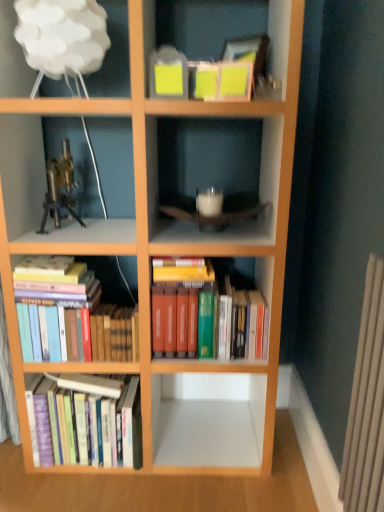
Question: Is hardcover books at lower left, which is counted as the second book, starting from the right, taller or shorter than gold metallic microscope at upper left?

Choices:
 (A) short
 (B) tall

Answer: (B)

Question: From a real-world perspective, is hardcover books at lower left, which is counted as the second book, starting from the right, above or below gold metallic microscope at upper left?

Choices:
 (A) above
 (B) below

Answer: (B)

Question: Which object is the closest to the hardcover books at center, placed as the first book when sorted from right to left?

Choices:
 (A) hardcover books at lower left, positioned as the 2th book in left-to-right order
 (B) hardcover books at lower left, which is the 3th book in right-to-left order
 (C) white cloud lampshade at upper left
 (D) gold metallic microscope at upper left

Answer: (A)

Question: Estimate the real-world distances between objects in this image. Which object is farther from the gold metallic microscope at upper left?

Choices:
 (A) hardcover books at center, marked as the 3th book in a left-to-right arrangement
 (B) white cloud lampshade at upper left
 (C) hardcover books at lower left, positioned as the 2th book in left-to-right order
 (D) hardcover books at lower left, which is the 1th book from left to right

Answer: (D)